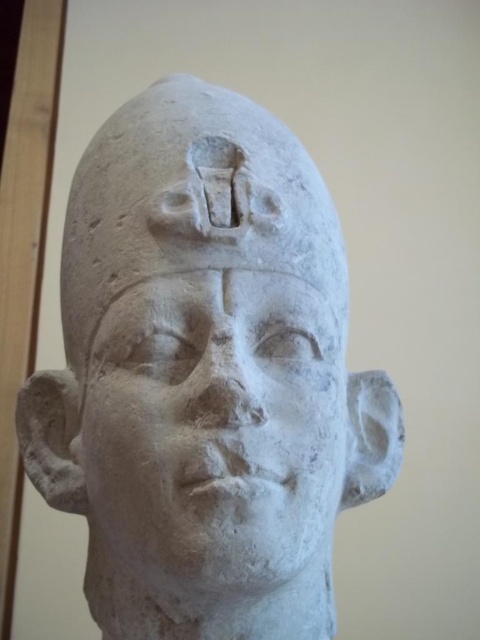
Question: Is white stone head at center in front of white stone face at center?

Choices:
 (A) no
 (B) yes

Answer: (B)

Question: Is white stone head at center positioned in front of white stone face at center?

Choices:
 (A) no
 (B) yes

Answer: (B)

Question: Which point is closer to the camera taking this photo?

Choices:
 (A) (96, 477)
 (B) (231, 531)

Answer: (B)

Question: Is white stone head at center to the right of white stone face at center from the viewer's perspective?

Choices:
 (A) no
 (B) yes

Answer: (A)